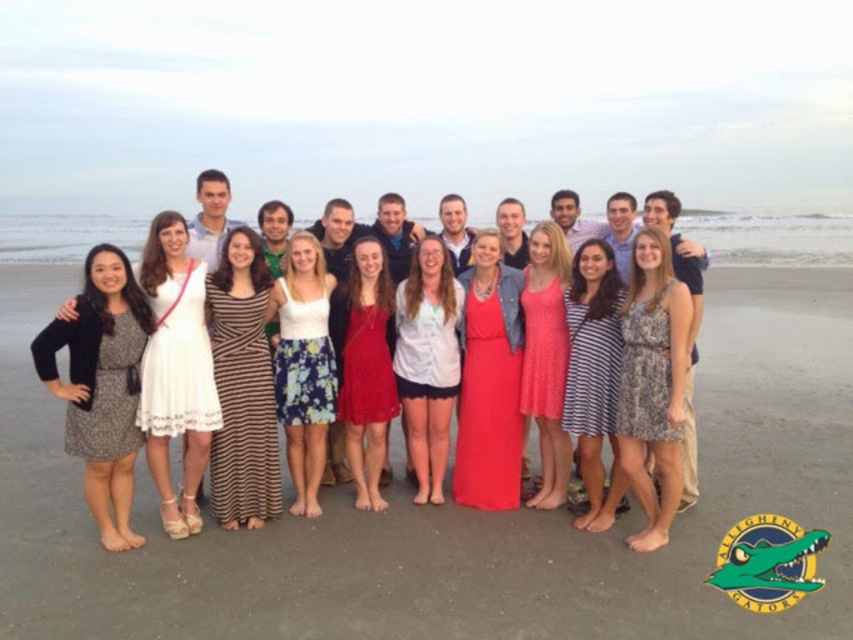
You are a photographer trying to adjust the focus on your camera. You want to ensure that both the white floral skirt at center and the striped cotton dress at center are clearly visible in the photo. Which clothing item should you focus on first to ensure both are in focus?

The white floral skirt at center is positioned over the striped cotton dress at center, so focusing on the white floral skirt at center first will ensure both are in focus.